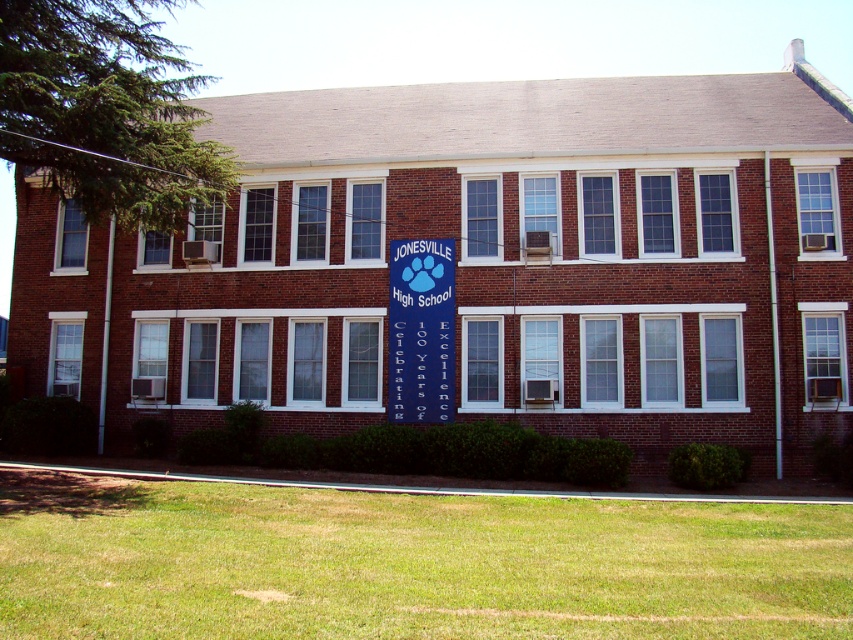
You are standing at the entrance of Jonesville High School and want to walk to the point marked by point (680, 196). However, there is an obstacle at point (79, 611). Can you reach your destination without passing through the obstacle?

Point (680, 196) is behind point (79, 611), so you can reach point (680, 196) without passing through the obstacle at point (79, 611) because it is located behind it.